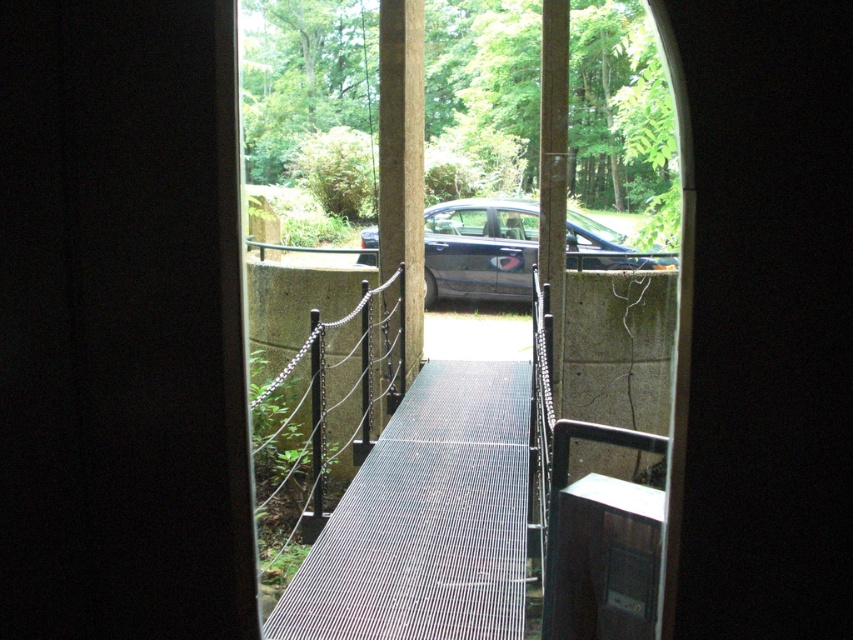
Which is more to the right, metallic grid walkway at center or glossy metallic car at center?

From the viewer's perspective, glossy metallic car at center appears more on the right side.

Which is below, metallic grid walkway at center or glossy metallic car at center?

metallic grid walkway at center is lower down.

The width and height of the screenshot is (853, 640). Find the location of `metallic grid walkway at center`. metallic grid walkway at center is located at coordinates (427, 518).

I want to click on metallic grid walkway at center, so click(427, 518).